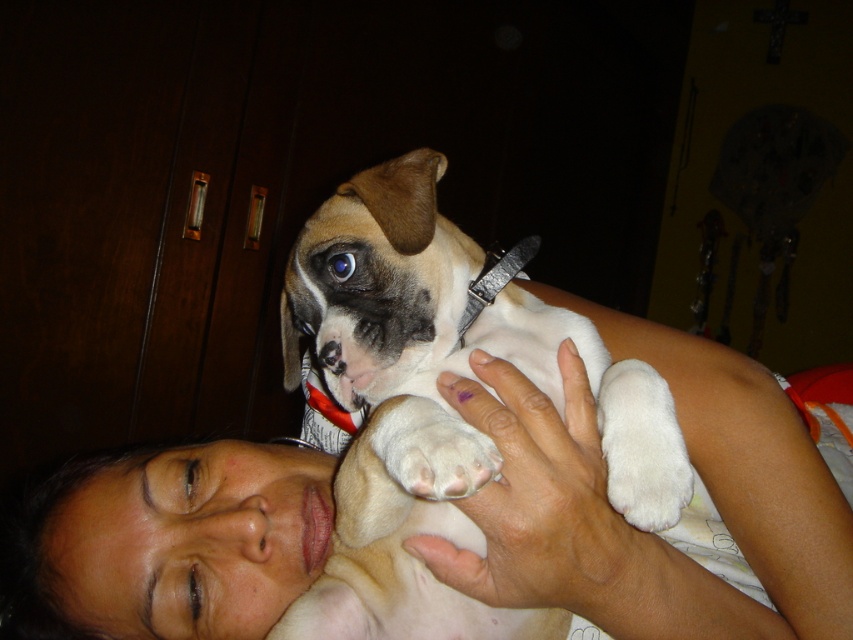
From the picture: Which is above, smooth skin face at center or white matte dog at center?

white matte dog at center

Can you confirm if smooth skin face at center is wider than white matte dog at center?

Yes.

What are the coordinates of `smooth skin face at center` in the screenshot? It's located at (637, 529).

Can you confirm if white matte dog at center is positioned to the left of white soft paw at center?

Indeed, white matte dog at center is positioned on the left side of white soft paw at center.

Which is in front, point (457, 288) or point (422, 429)?

Point (422, 429)

Looking at this image, who is more forward, (370, 195) or (405, 474)?

Positioned in front is point (405, 474).

This screenshot has width=853, height=640. I want to click on white matte dog at center, so click(439, 404).

Does smooth skin face at center have a larger size compared to white soft paw at center?

Yes, smooth skin face at center is bigger than white soft paw at center.

Is point (550, 580) positioned after point (495, 465)?

That is True.

Find the location of a particular element. smooth skin face at center is located at coordinates (637, 529).